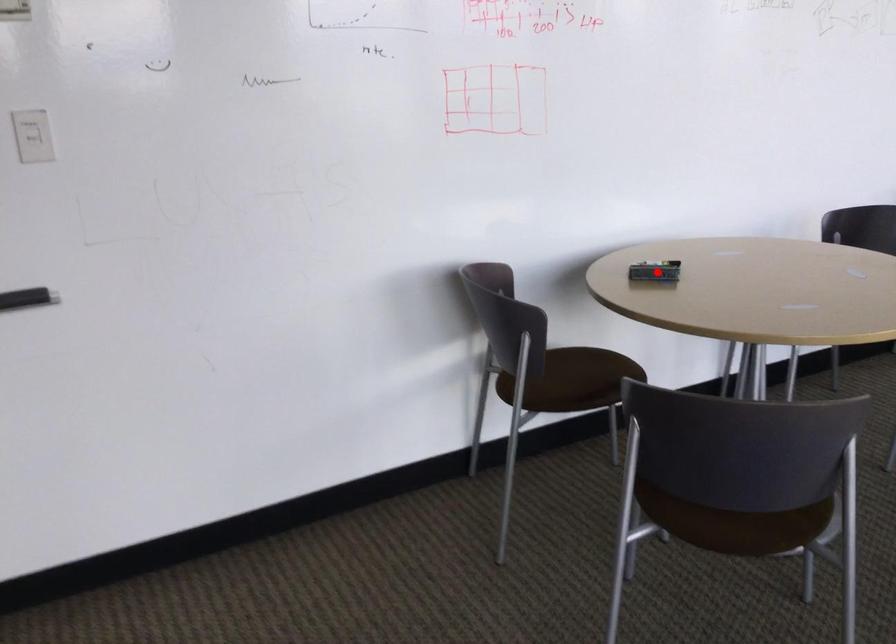
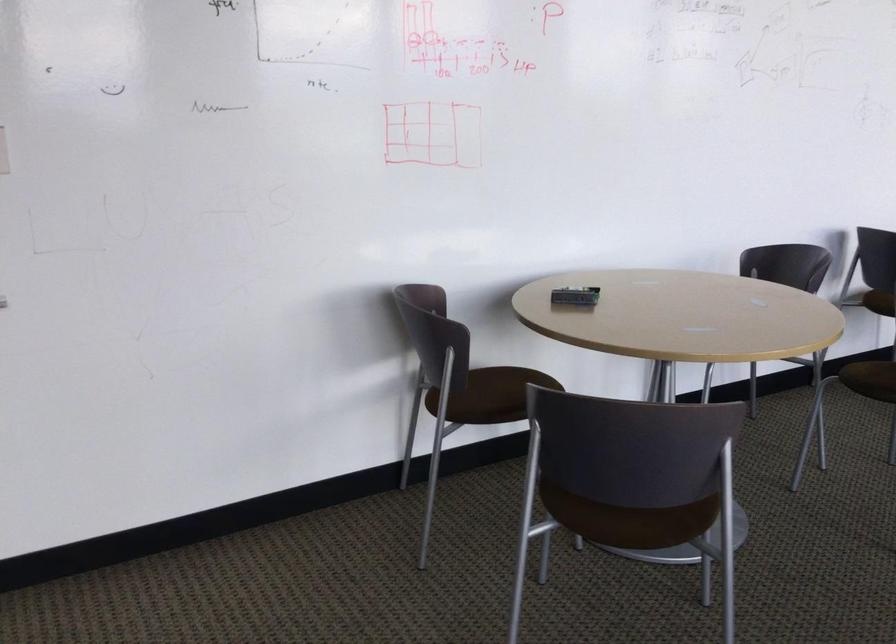
Locate, in the second image, the point that corresponds to the highlighted location in the first image.

(575, 296)